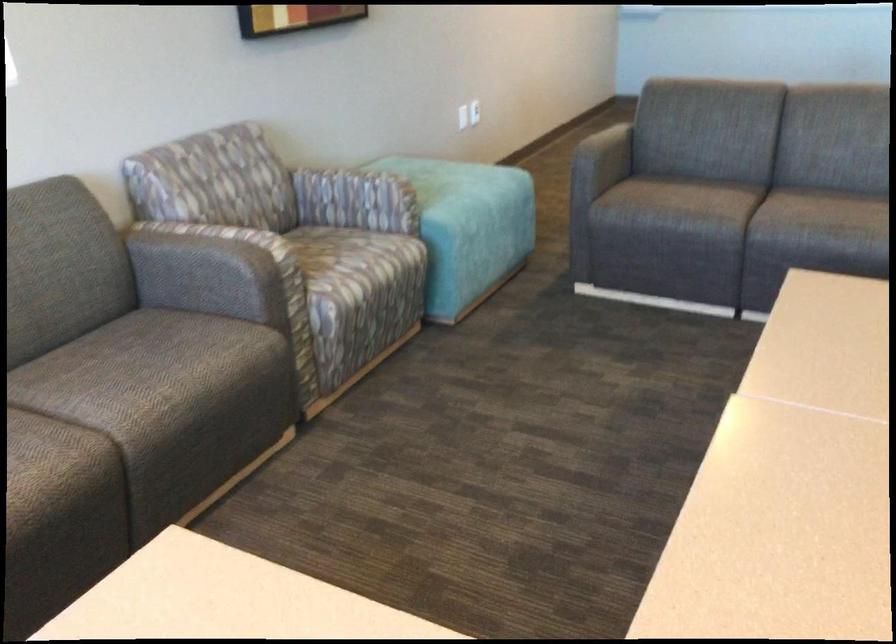
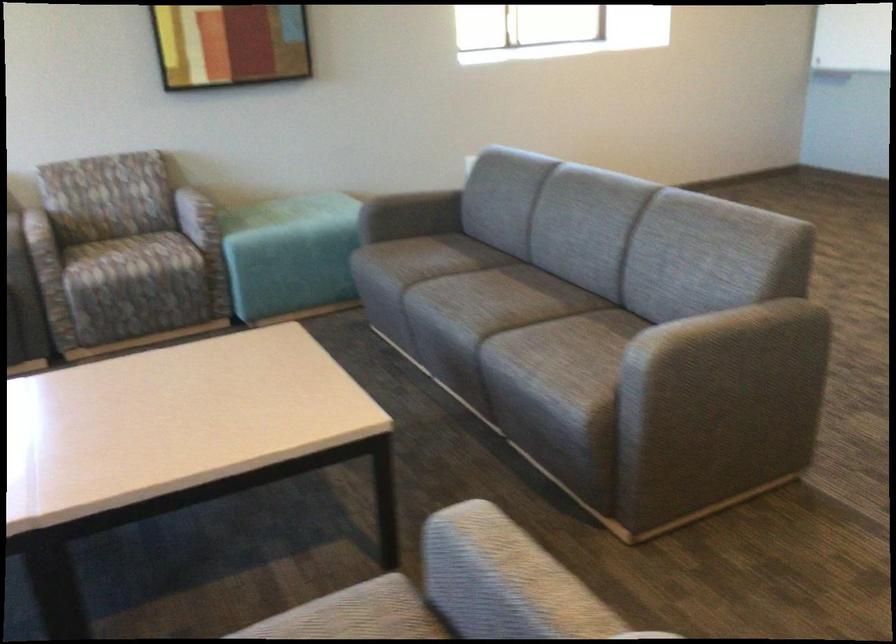
In the second image, find the point that corresponds to (x=604, y=154) in the first image.

(411, 213)